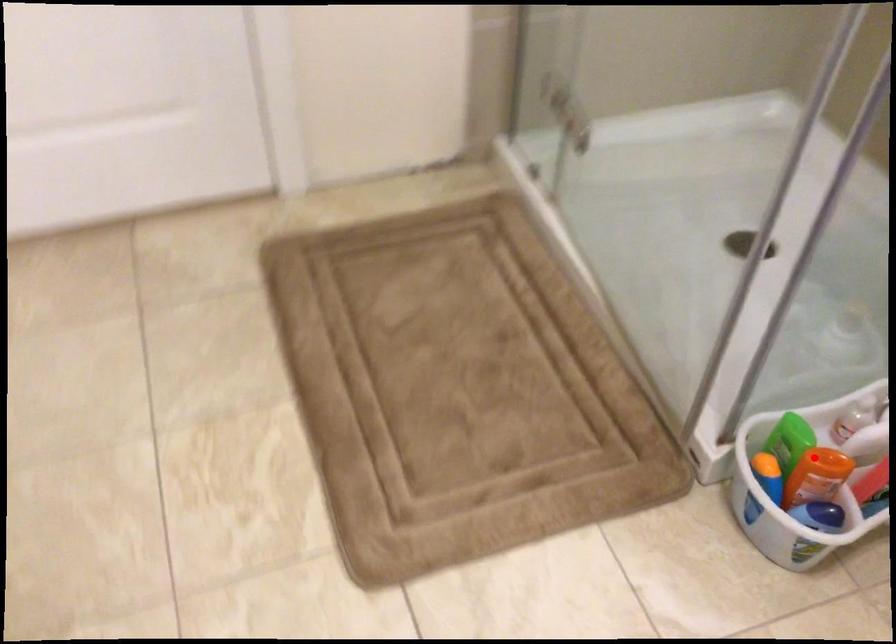
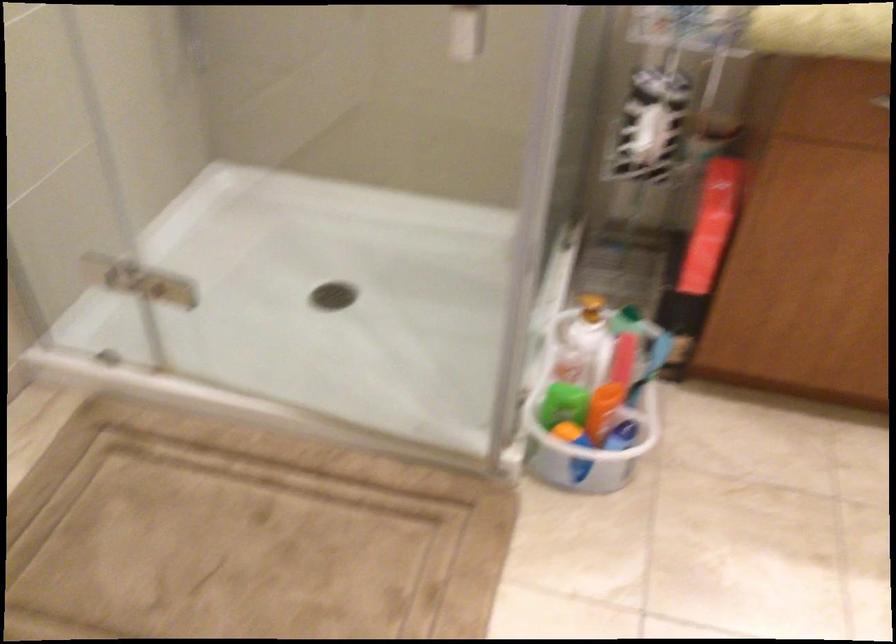
Where in the second image is the point corresponding to the highlighted location from the first image?

(595, 397)